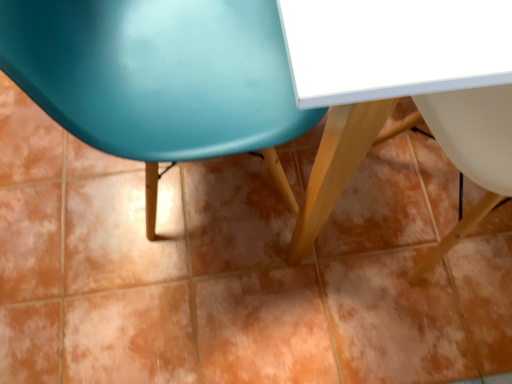
Question: Can you confirm if matte plastic chair at upper left is wider than white glossy table at center?

Choices:
 (A) no
 (B) yes

Answer: (A)

Question: Considering the relative sizes of matte plastic chair at upper left and white glossy table at center in the image provided, is matte plastic chair at upper left taller than white glossy table at center?

Choices:
 (A) no
 (B) yes

Answer: (B)

Question: From the image's perspective, is matte plastic chair at upper left located above white glossy table at center?

Choices:
 (A) yes
 (B) no

Answer: (B)

Question: Is white glossy table at center a part of matte plastic chair at upper left?

Choices:
 (A) no
 (B) yes

Answer: (A)

Question: Is matte plastic chair at upper left at the left side of white glossy table at center?

Choices:
 (A) yes
 (B) no

Answer: (A)

Question: Is the position of matte plastic chair at upper left more distant than that of white glossy table at center?

Choices:
 (A) yes
 (B) no

Answer: (A)

Question: Can you confirm if white glossy table at center is shorter than matte plastic chair at upper left?

Choices:
 (A) yes
 (B) no

Answer: (A)

Question: Considering the relative sizes of white glossy table at center and matte plastic chair at upper left in the image provided, is white glossy table at center thinner than matte plastic chair at upper left?

Choices:
 (A) yes
 (B) no

Answer: (B)

Question: Is matte plastic chair at upper left completely or partially inside white glossy table at center?

Choices:
 (A) yes
 (B) no

Answer: (B)

Question: Is white glossy table at center facing towards matte plastic chair at upper left?

Choices:
 (A) yes
 (B) no

Answer: (B)

Question: Can you confirm if white glossy table at center is taller than matte plastic chair at upper left?

Choices:
 (A) yes
 (B) no

Answer: (B)

Question: From a real-world perspective, is white glossy table at center located higher than matte plastic chair at upper left?

Choices:
 (A) yes
 (B) no

Answer: (B)

Question: From a real-world perspective, relative to matte plastic chair at upper left, is white glossy table at center vertically above or below?

Choices:
 (A) below
 (B) above

Answer: (A)